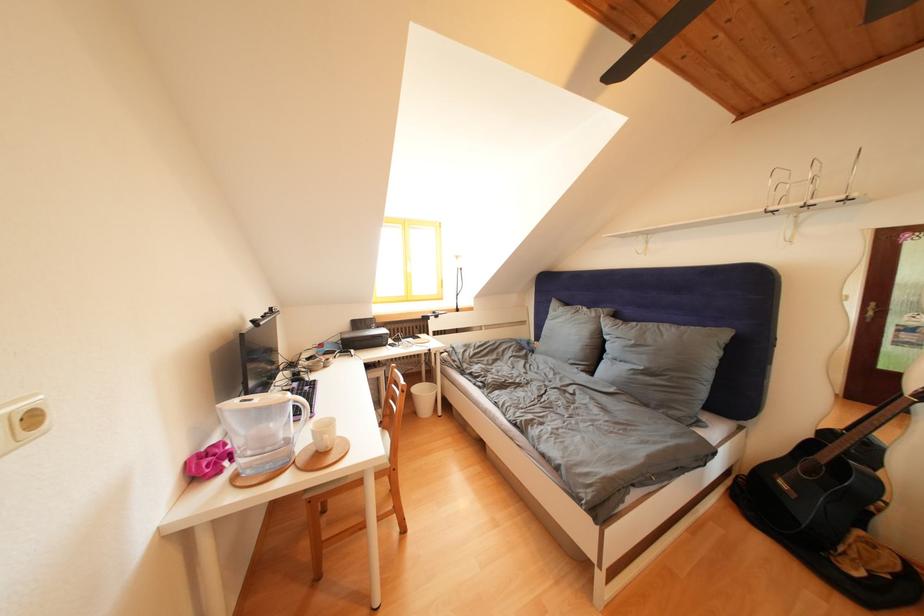
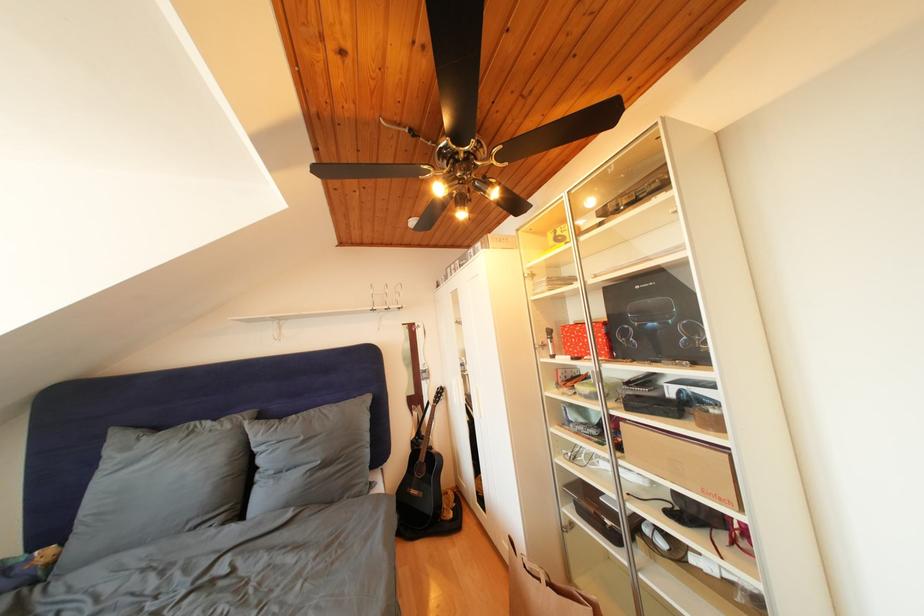
Where in the second image is the point corresponding to the point at 602,320 from the first image?

(236, 432)